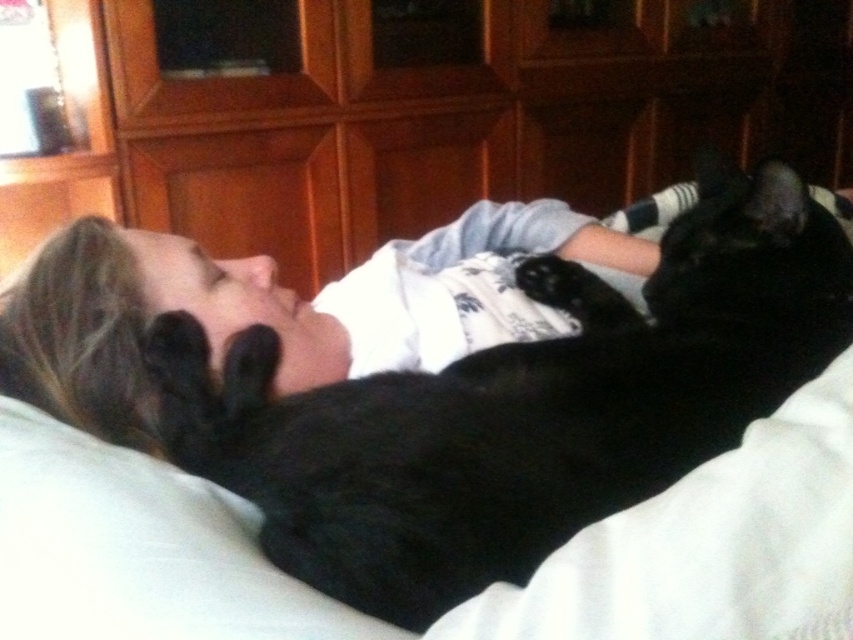
You are a pet sitter and need to place a small toy between the black fur cat at upper center and the white soft pillow at upper left. Can you fit the toy there?

The black fur cat at upper center is 8.54 inches away from the white soft pillow at upper left, so yes, the toy can be placed between them as there is sufficient space.

Consider the image. You are a photographer wanting to capture a clear photo of the white soft pillow at upper left without the black fur cat at upper center blocking it. What should you do?

The black fur cat at upper center is taller than the white soft pillow at upper left, so you can move the camera lower to position the pillow above the cat or adjust the angle to ensure the cat doesn

You are a photographer standing in the bedroom and want to take a closeup photo of the black fur cat at upper center without moving the cat. Given that your camera has a minimum focusing distance of 18 inches, will you be able to take the photo?

The black fur cat at upper center and viewer are 19.07 inches apart, so yes, you can take the photo since the distance is greater than the camera minimum focusing distance of 18 inches.